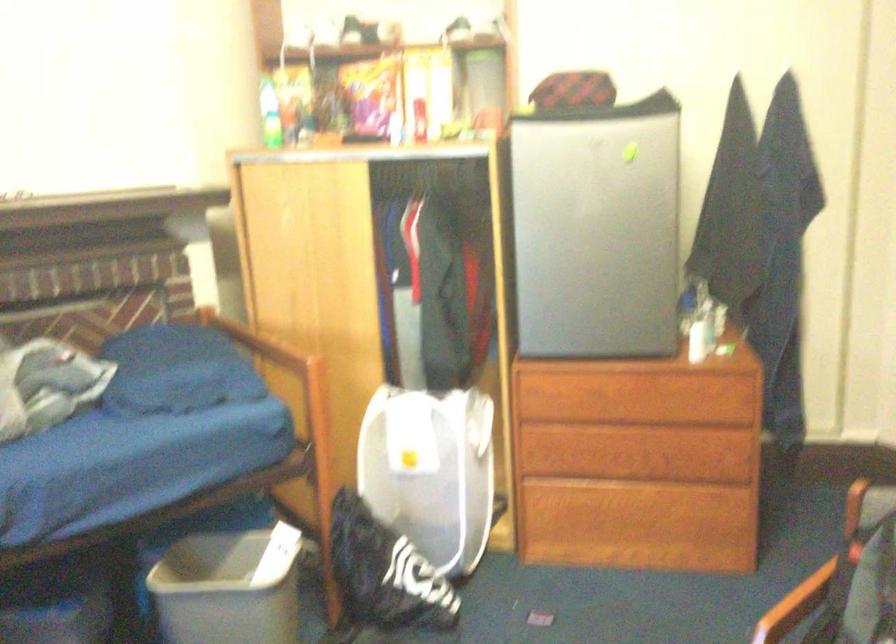
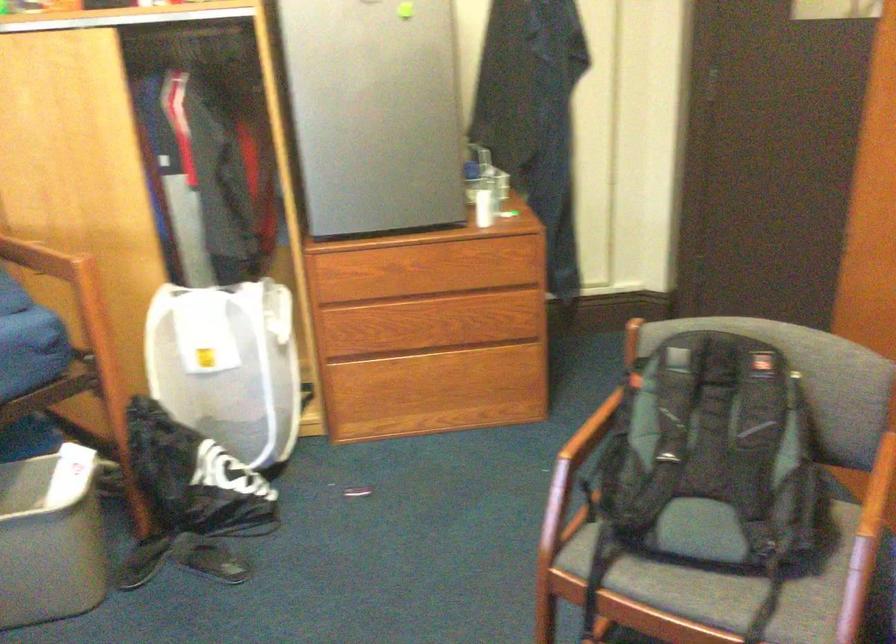
What movement of the cameraman would produce the second image?

The movement direction of the cameraman is left, forward.